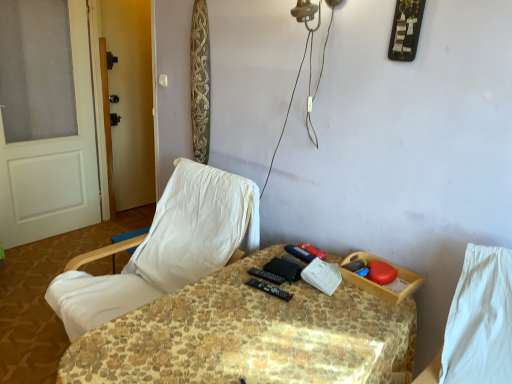
Locate an element on the screen. This screenshot has height=384, width=512. empty space that is to the right of black plastic remote control at center is located at coordinates (309, 299).